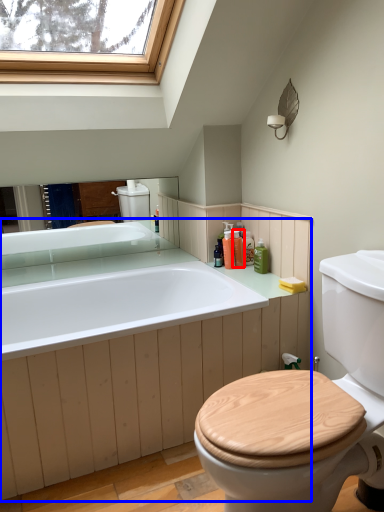
Question: Which object appears closest to the camera in this image, toiletry (highlighted by a red box) or counter top (highlighted by a blue box)?

Choices:
 (A) toiletry
 (B) counter top

Answer: (B)